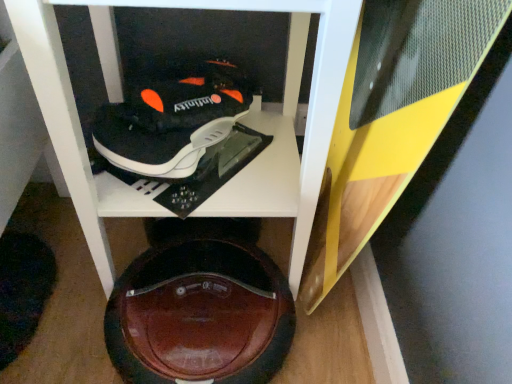
What is the approximate height of shiny brown shoe at bottom center?

shiny brown shoe at bottom center is 3.54 inches tall.

What do you see at coordinates (188, 124) in the screenshot? The image size is (512, 384). I see `wooden cabinet at center` at bounding box center [188, 124].

The height and width of the screenshot is (384, 512). What do you see at coordinates (173, 119) in the screenshot?
I see `black matte shoe at upper center` at bounding box center [173, 119].

The width and height of the screenshot is (512, 384). I want to click on shiny brown shoe at bottom center, so click(x=200, y=315).

Is shiny brown shoe at bottom center wider than black matte shoe at upper center?

Indeed, shiny brown shoe at bottom center has a greater width compared to black matte shoe at upper center.

From the image's perspective, is shiny brown shoe at bottom center located beneath black matte shoe at upper center?

Yes, from the image's perspective, shiny brown shoe at bottom center is below black matte shoe at upper center.

From the picture: Considering the sizes of shiny brown shoe at bottom center and black matte shoe at upper center in the image, is shiny brown shoe at bottom center bigger or smaller than black matte shoe at upper center?

In the image, shiny brown shoe at bottom center appears to be larger than black matte shoe at upper center.

Is shiny brown shoe at bottom center taller or shorter than black matte shoe at upper center?

In the image, shiny brown shoe at bottom center appears to be shorter than black matte shoe at upper center.

Find the location of a particular element. This screenshot has width=512, height=384. footwear behind the wooden cabinet at center is located at coordinates (200, 315).

Based on the photo, is shiny brown shoe at bottom center inside wooden cabinet at center?

Yes.

Is wooden cabinet at center in front of shiny brown shoe at bottom center?

Yes, it is.

How many degrees apart are the facing directions of wooden cabinet at center and black matte shoe at upper center?

The angular difference between wooden cabinet at center and black matte shoe at upper center is 37.9 degrees.

From the image's perspective, who appears lower, wooden cabinet at center or black matte shoe at upper center?

wooden cabinet at center, from the image's perspective.

Considering their positions, is wooden cabinet at center located in front of or behind black matte shoe at upper center?

wooden cabinet at center is in front of black matte shoe at upper center.

Can you confirm if shiny brown shoe at bottom center is taller than wooden cabinet at center?

No, shiny brown shoe at bottom center is not taller than wooden cabinet at center.

Is wooden cabinet at center inside shiny brown shoe at bottom center?

No, wooden cabinet at center is located outside of shiny brown shoe at bottom center.

Does point (135, 266) come behind point (50, 3)?

Yes, it is behind point (50, 3).

Where is `furniture that appears above the shiny brown shoe at bottom center (from the image's perspective)`? furniture that appears above the shiny brown shoe at bottom center (from the image's perspective) is located at coordinates (188, 124).

Between point (149, 137) and point (46, 28), which one is positioned in front?

The point (46, 28) is more forward.

Based on the photo, from a real-world perspective, which is physically below, black matte shoe at upper center or wooden cabinet at center?

From a 3D spatial view, wooden cabinet at center is below.

From the picture: Which object is closer to the camera taking this photo, black matte shoe at upper center or wooden cabinet at center?

wooden cabinet at center.

Which is more to the right, black matte shoe at upper center or wooden cabinet at center?

From the viewer's perspective, wooden cabinet at center appears more on the right side.

Consider the image. Is black matte shoe at upper center oriented towards shiny brown shoe at bottom center?

No, black matte shoe at upper center is not turned towards shiny brown shoe at bottom center.

From their relative heights in the image, would you say black matte shoe at upper center is taller or shorter than shiny brown shoe at bottom center?

Considering their sizes, black matte shoe at upper center has more height than shiny brown shoe at bottom center.

From the image's perspective, which one is positioned higher, black matte shoe at upper center or shiny brown shoe at bottom center?

black matte shoe at upper center.

How different are the orientations of black matte shoe at upper center and shiny brown shoe at bottom center in degrees?

37.5 degrees.

Locate an element on the screen. This screenshot has height=384, width=512. shoe located above the shiny brown shoe at bottom center (from the image's perspective) is located at coordinates (173, 119).

The image size is (512, 384). What are the coordinates of `furniture that appears on the right of shiny brown shoe at bottom center` in the screenshot? It's located at (188, 124).

Which object lies further to the anchor point black matte shoe at upper center, shiny brown shoe at bottom center or wooden cabinet at center?

shiny brown shoe at bottom center is further to black matte shoe at upper center.

Estimate the real-world distances between objects in this image. Which object is further from shiny brown shoe at bottom center, wooden cabinet at center or black matte shoe at upper center?

Based on the image, black matte shoe at upper center appears to be further to shiny brown shoe at bottom center.

Based on their spatial positions, is wooden cabinet at center or shiny brown shoe at bottom center closer to black matte shoe at upper center?

Based on the image, wooden cabinet at center appears to be nearer to black matte shoe at upper center.

From the image, which object appears to be farther from wooden cabinet at center, shiny brown shoe at bottom center or black matte shoe at upper center?

shiny brown shoe at bottom center is positioned further to the anchor wooden cabinet at center.

Looking at the image, which one is located closer to shiny brown shoe at bottom center, black matte shoe at upper center or wooden cabinet at center?

Among the two, wooden cabinet at center is located nearer to shiny brown shoe at bottom center.

Looking at the image, which one is located closer to wooden cabinet at center, black matte shoe at upper center or shiny brown shoe at bottom center?

black matte shoe at upper center lies closer to wooden cabinet at center than the other object.

Where is `furniture between black matte shoe at upper center and shiny brown shoe at bottom center in the up-down direction`? The image size is (512, 384). furniture between black matte shoe at upper center and shiny brown shoe at bottom center in the up-down direction is located at coordinates (188, 124).